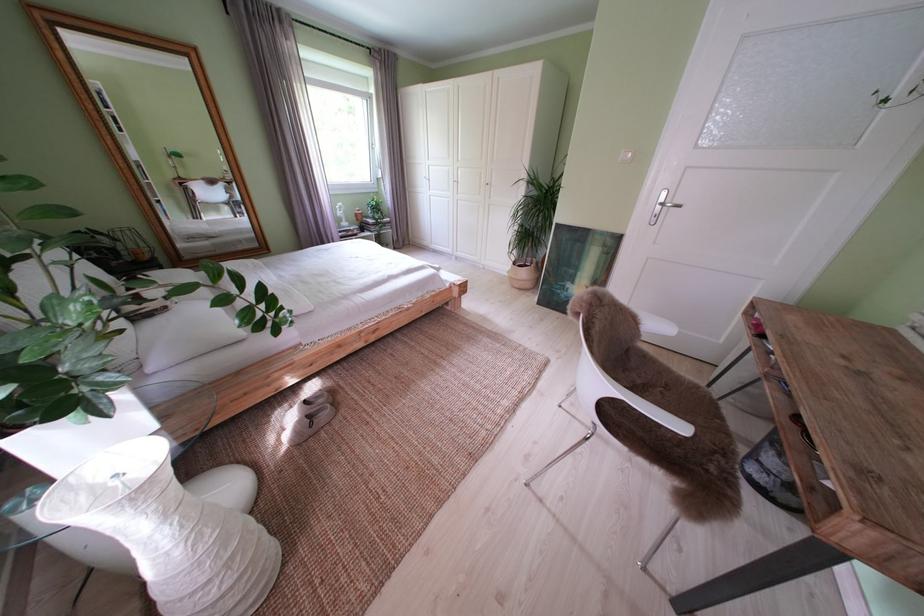
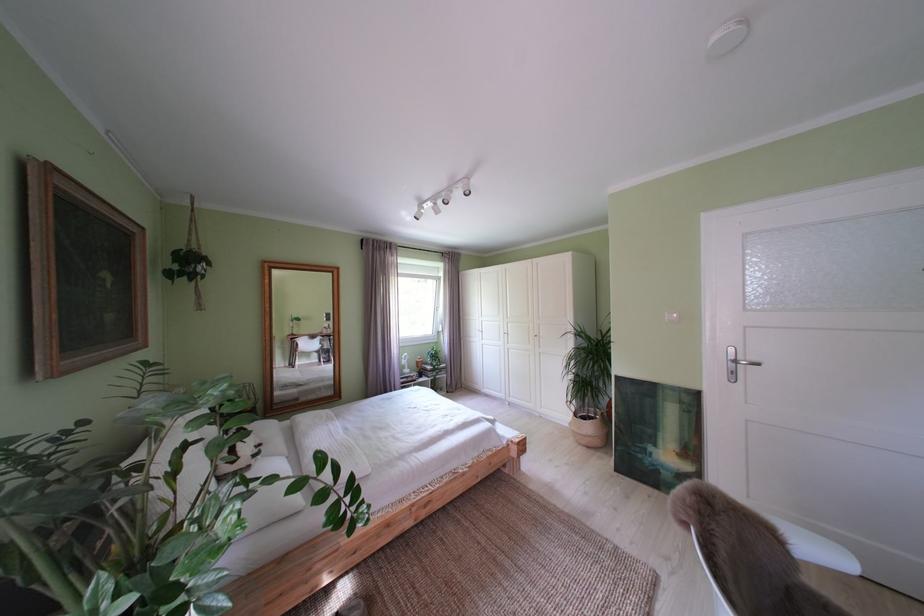
Where in the second image is the point corresponding to pixel 673 205 from the first image?

(743, 363)